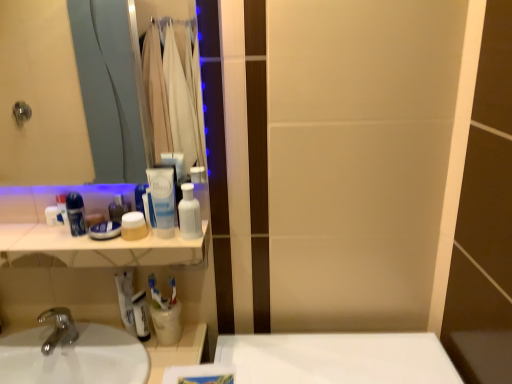
Image resolution: width=512 pixels, height=384 pixels. What are the coordinates of `vacant area situated to the left side of white matte toothpaste at lower left` in the screenshot? It's located at (87, 339).